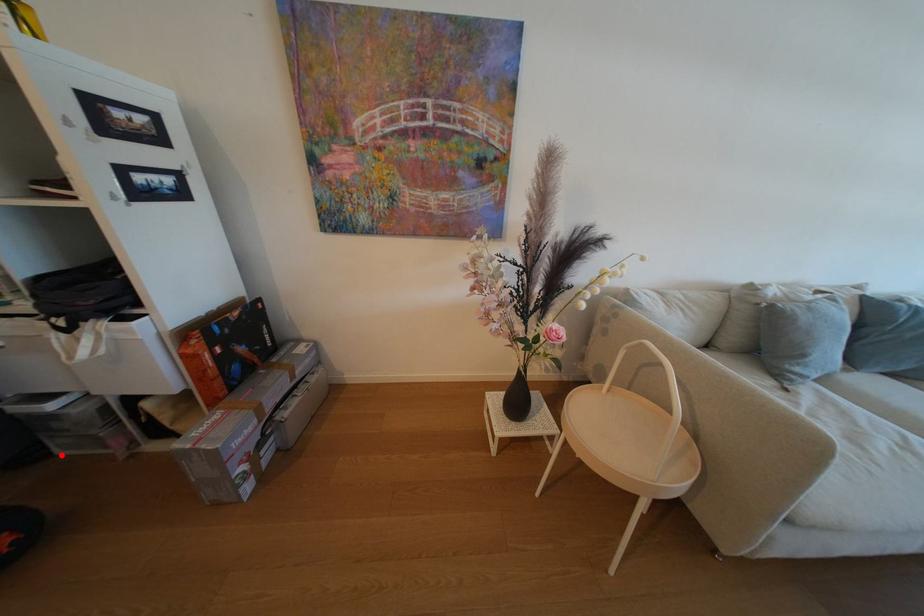
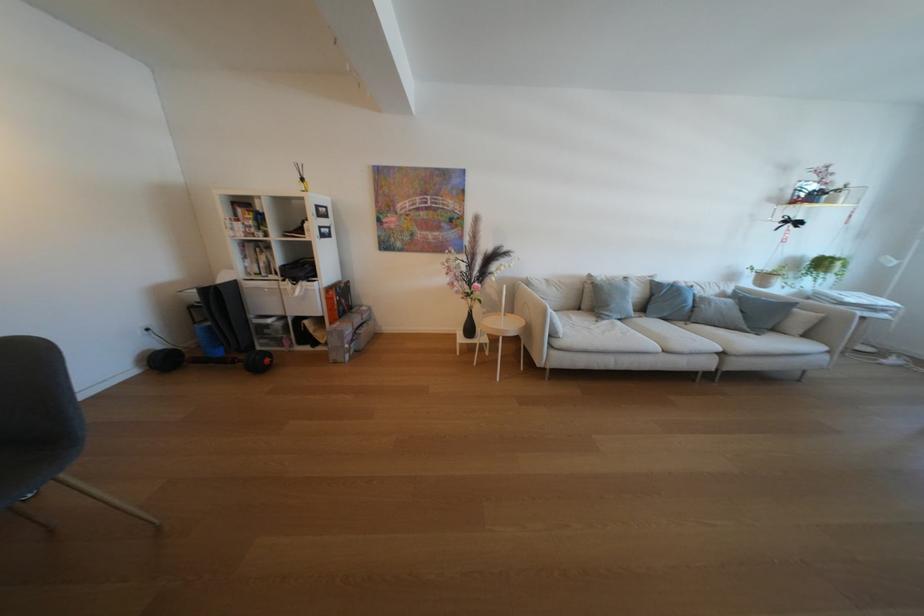
In the second image, find the point that corresponds to the highlighted location in the first image.

(265, 351)